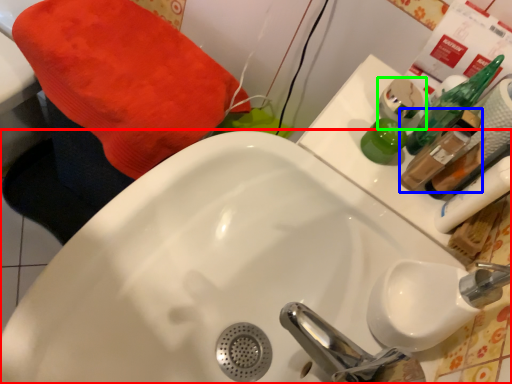
Question: Which object is the closest to the sink (highlighted by a red box)? Choose among these: mouthwash (highlighted by a blue box) or mouthwash (highlighted by a green box).

Choices:
 (A) mouthwash
 (B) mouthwash

Answer: (A)